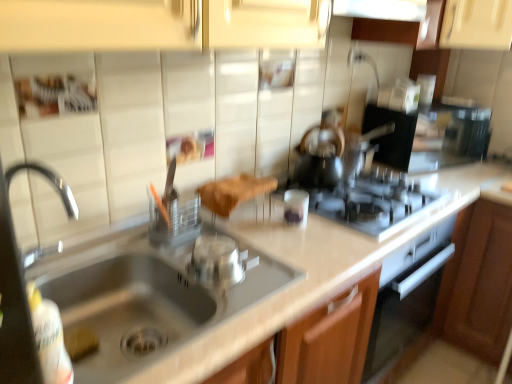
Find the location of `vacant space in between silver metallic pot at center, the 1th appliance from the bottom, and brown fabric at center`. vacant space in between silver metallic pot at center, the 1th appliance from the bottom, and brown fabric at center is located at coordinates (227, 246).